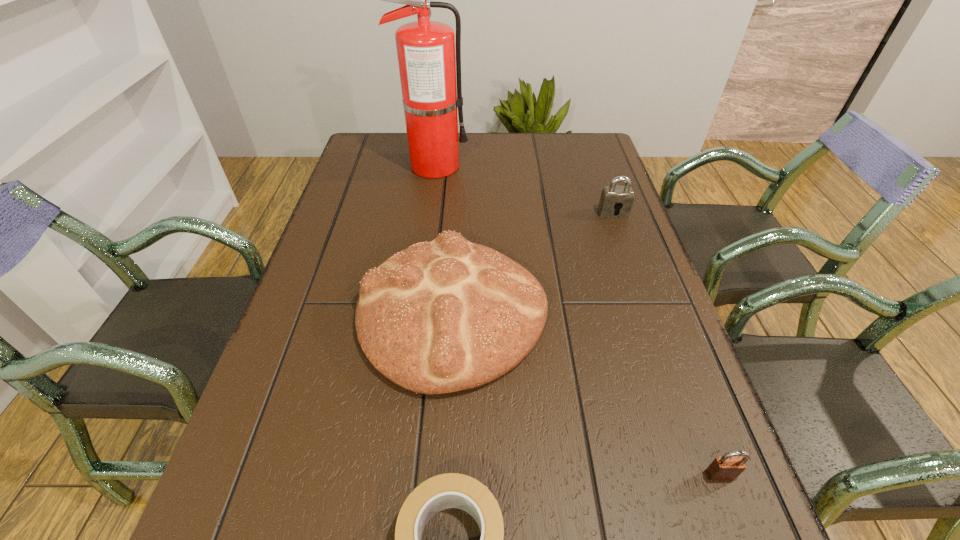
This screenshot has height=540, width=960. Identify the location of fire extinguisher. (428, 68).

I want to click on the farthest object, so click(x=428, y=68).

The width and height of the screenshot is (960, 540). What are the coordinates of `the fourth shortest object` in the screenshot? It's located at (438, 317).

Locate an element on the screen. The height and width of the screenshot is (540, 960). bread is located at coordinates (438, 317).

This screenshot has width=960, height=540. Identify the location of the farther padlock. (613, 197).

Where is `the fourth nearest object`? the fourth nearest object is located at coordinates (613, 197).

The height and width of the screenshot is (540, 960). I want to click on the fourth farthest object, so click(728, 467).

Find the location of `the shorter padlock`. the shorter padlock is located at coordinates (728, 467).

This screenshot has height=540, width=960. I want to click on vacant space located 0.380m at the nozzle of the fire extinguisher, so [x=590, y=166].

Where is `free location located 0.390m on the back of the fourth shortest object`? This screenshot has width=960, height=540. free location located 0.390m on the back of the fourth shortest object is located at coordinates (461, 168).